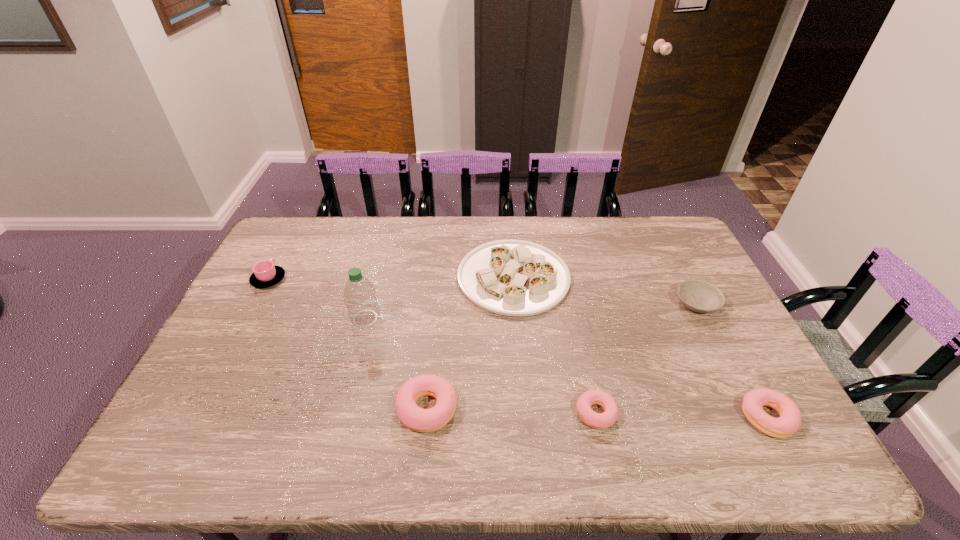
Identify the location of free location located on the back of the rightmost doughnut. (745, 375).

Find the location of `blank area located 0.050m on the back of the platter`. blank area located 0.050m on the back of the platter is located at coordinates (510, 235).

Image resolution: width=960 pixels, height=540 pixels. In order to click on blank space located on the left of the bowl in this screenshot , I will do `click(616, 303)`.

In order to click on vacant region located on the left of the sixth object from right to left in this screenshot , I will do `click(261, 318)`.

Where is `vacant space located 0.100m on the side with the handle of the leftmost object`? The image size is (960, 540). vacant space located 0.100m on the side with the handle of the leftmost object is located at coordinates (284, 250).

Find the location of a particular element. free space located on the side with the handle of the leftmost object is located at coordinates (284, 250).

Image resolution: width=960 pixels, height=540 pixels. What are the coordinates of `vacant space located 0.280m on the side with the handle of the leftmost object` in the screenshot? It's located at (300, 221).

Locate an element on the screen. The width and height of the screenshot is (960, 540). object present at the far edge is located at coordinates (510, 277).

Where is `object that is at the left edge`? The width and height of the screenshot is (960, 540). object that is at the left edge is located at coordinates (265, 274).

Find the location of a particular element. The height and width of the screenshot is (540, 960). doughnut that is at the right edge is located at coordinates (789, 422).